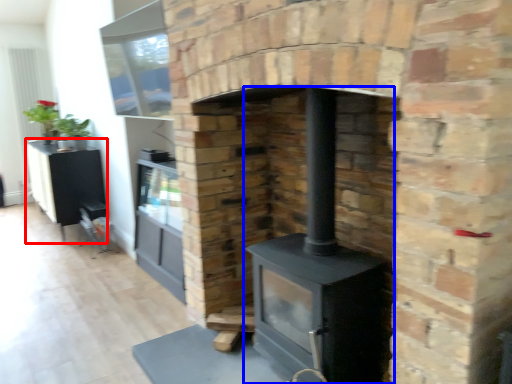
Question: Which of the following is the farthest to the observer, entertainment center (highlighted by a red box) or wood burning stove (highlighted by a blue box)?

Choices:
 (A) entertainment center
 (B) wood burning stove

Answer: (A)